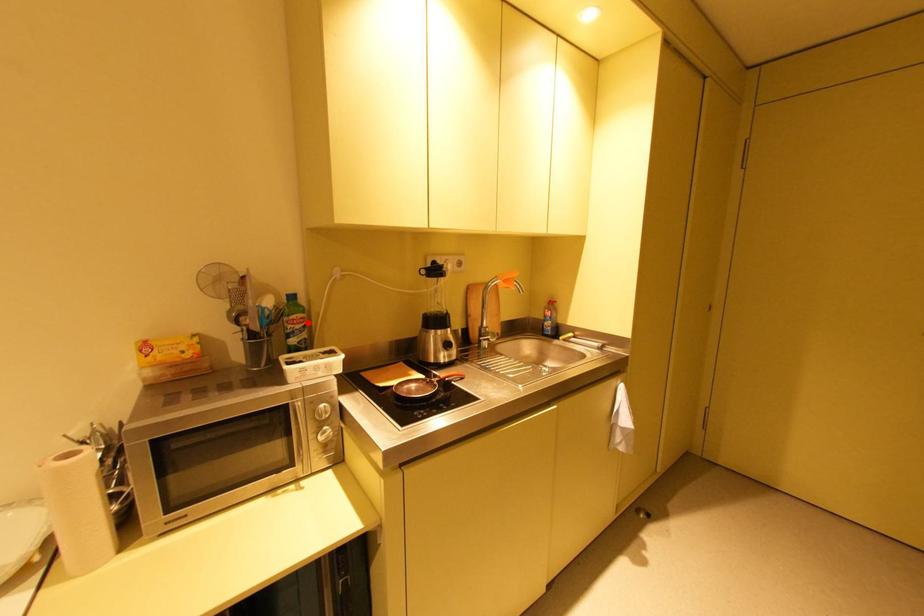
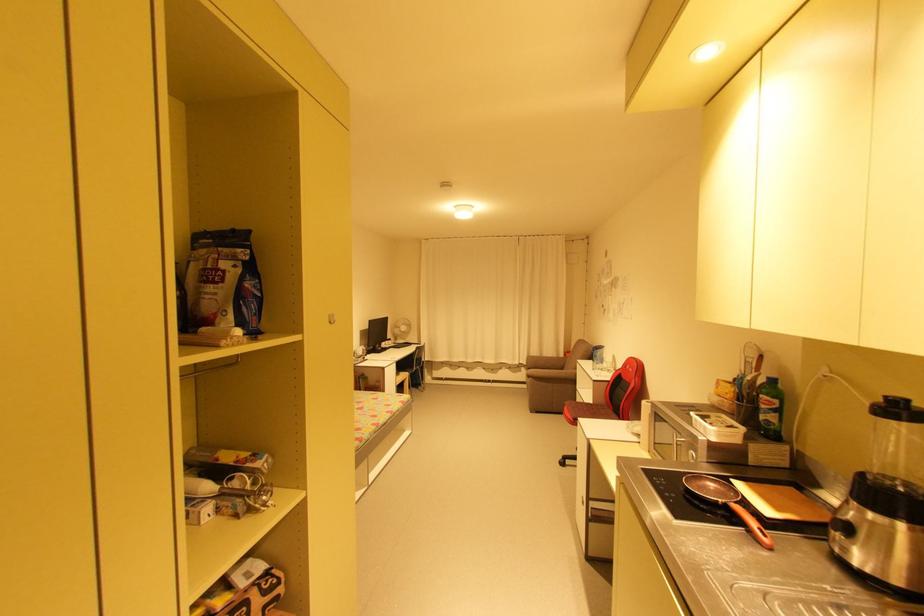
Question: I am providing you with two images of the same scene from different viewpoints. A red point is marked on the first image. At the location where the point appears in image 1, is it still visible in image 2?

Choices:
 (A) Yes
 (B) No

Answer: (A)